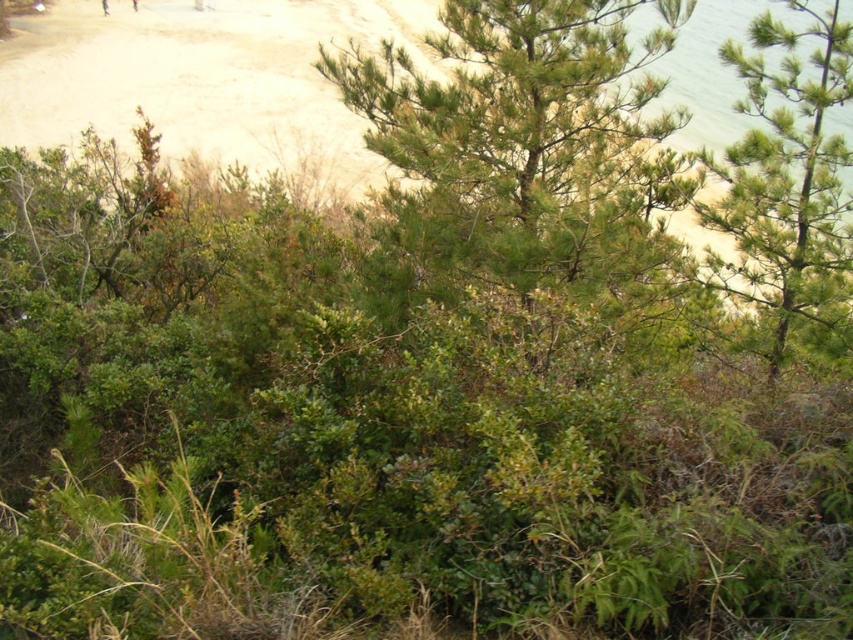
Does green needle-like at center appear on the right side of green needle-like at upper right?

No, green needle-like at center is not to the right of green needle-like at upper right.

Is point (518, 33) positioned after point (809, 269)?

No, (518, 33) is closer to viewer.

Find the location of a particular element. This screenshot has height=640, width=853. green needle-like at center is located at coordinates (534, 148).